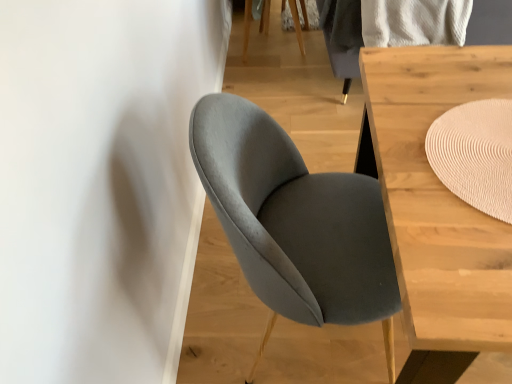
Question: Can you confirm if suede gray chair at center is wider than beige woven mat at upper right?

Choices:
 (A) no
 (B) yes

Answer: (B)

Question: Does suede gray chair at center turn towards beige woven mat at upper right?

Choices:
 (A) yes
 (B) no

Answer: (A)

Question: Would you say suede gray chair at center is a long distance from beige woven mat at upper right?

Choices:
 (A) no
 (B) yes

Answer: (A)

Question: Is suede gray chair at center in contact with beige woven mat at upper right?

Choices:
 (A) yes
 (B) no

Answer: (B)

Question: Can you confirm if suede gray chair at center is bigger than beige woven mat at upper right?

Choices:
 (A) no
 (B) yes

Answer: (B)

Question: Relative to light wood table at center, is suede gray chair at center in front or behind?

Choices:
 (A) behind
 (B) front

Answer: (A)

Question: From their relative heights in the image, would you say suede gray chair at center is taller or shorter than light wood table at center?

Choices:
 (A) short
 (B) tall

Answer: (B)

Question: Considering the positions of point (296, 291) and point (385, 79), is point (296, 291) closer or farther from the camera than point (385, 79)?

Choices:
 (A) farther
 (B) closer

Answer: (B)

Question: In terms of width, does suede gray chair at center look wider or thinner when compared to light wood table at center?

Choices:
 (A) thin
 (B) wide

Answer: (A)

Question: From the image's perspective, relative to beige woven mat at upper right, is light wood table at center above or below?

Choices:
 (A) below
 (B) above

Answer: (A)

Question: Is light wood table at center wider or thinner than beige woven mat at upper right?

Choices:
 (A) thin
 (B) wide

Answer: (B)

Question: Based on their sizes in the image, would you say light wood table at center is bigger or smaller than beige woven mat at upper right?

Choices:
 (A) small
 (B) big

Answer: (B)

Question: Is light wood table at center taller or shorter than beige woven mat at upper right?

Choices:
 (A) tall
 (B) short

Answer: (A)

Question: Considering their positions, is beige woven mat at upper right located in front of or behind light wood table at center?

Choices:
 (A) behind
 (B) front

Answer: (A)

Question: Do you think beige woven mat at upper right is within light wood table at center, or outside of it?

Choices:
 (A) inside
 (B) outside

Answer: (A)